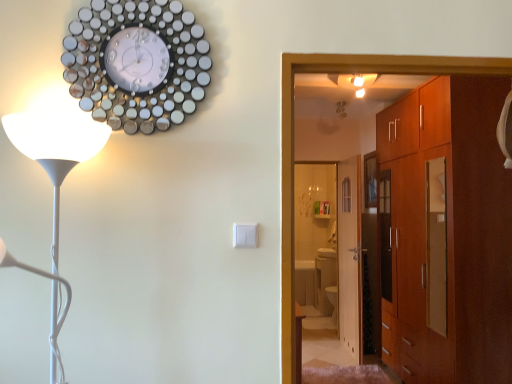
Question: Can you confirm if white glossy floor lamp at left is wider than metallic circular clock at upper left?

Choices:
 (A) no
 (B) yes

Answer: (B)

Question: Does white glossy floor lamp at left have a greater height compared to metallic circular clock at upper left?

Choices:
 (A) no
 (B) yes

Answer: (B)

Question: From a real-world perspective, is white glossy floor lamp at left located higher than metallic circular clock at upper left?

Choices:
 (A) no
 (B) yes

Answer: (A)

Question: Considering the relative positions of white glossy floor lamp at left and metallic circular clock at upper left in the image provided, is white glossy floor lamp at left behind metallic circular clock at upper left?

Choices:
 (A) yes
 (B) no

Answer: (B)

Question: Can we say white glossy floor lamp at left lies outside metallic circular clock at upper left?

Choices:
 (A) yes
 (B) no

Answer: (A)

Question: Is wooden door at center in front of or behind metallic circular clock at upper left in the image?

Choices:
 (A) behind
 (B) front

Answer: (A)

Question: From a real-world perspective, is wooden door at center physically located above or below metallic circular clock at upper left?

Choices:
 (A) below
 (B) above

Answer: (A)

Question: In the image, is wooden door at center on the left side or the right side of metallic circular clock at upper left?

Choices:
 (A) right
 (B) left

Answer: (A)

Question: In terms of height, does wooden door at center look taller or shorter compared to metallic circular clock at upper left?

Choices:
 (A) tall
 (B) short

Answer: (A)

Question: Is point (36, 144) positioned closer to the camera than point (434, 226)?

Choices:
 (A) closer
 (B) farther

Answer: (A)

Question: From a real-world perspective, is white glossy floor lamp at left physically located above or below matte brown cabinet at right?

Choices:
 (A) below
 (B) above

Answer: (B)

Question: From the image's perspective, is white glossy floor lamp at left positioned above or below matte brown cabinet at right?

Choices:
 (A) below
 (B) above

Answer: (B)

Question: In the image, is white glossy floor lamp at left on the left side or the right side of matte brown cabinet at right?

Choices:
 (A) right
 (B) left

Answer: (B)

Question: Is point (340, 188) positioned closer to the camera than point (35, 142)?

Choices:
 (A) closer
 (B) farther

Answer: (B)

Question: Would you say wooden door at center is to the left or to the right of white glossy floor lamp at left in the picture?

Choices:
 (A) right
 (B) left

Answer: (A)